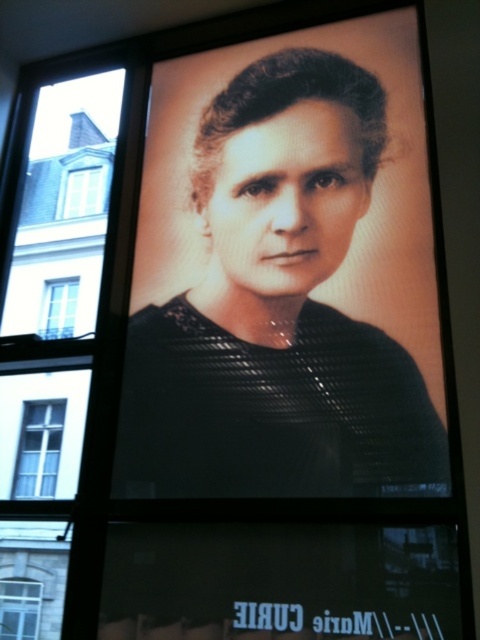
Question: Is white glass window at upper left to the left of clear glass window at upper left from the viewer's perspective?

Choices:
 (A) yes
 (B) no

Answer: (B)

Question: Estimate the real-world distances between objects in this image. Which object is farther from the black textured fabric at center?

Choices:
 (A) white glass window at left
 (B) white glass window at upper left
 (C) clear glass window at upper left

Answer: (B)

Question: Which object is the farthest from the clear glass window at upper left?

Choices:
 (A) white glass window at left
 (B) clear glass window at lower left
 (C) black textured fabric at center
 (D) white glass window at upper left

Answer: (B)

Question: Which point appears farthest from the camera in this image?

Choices:
 (A) (25, 436)
 (B) (70, 294)
 (C) (86, 214)
 (D) (310, 244)

Answer: (C)

Question: Is black textured fabric at center positioned behind clear glass window at upper left?

Choices:
 (A) no
 (B) yes

Answer: (A)

Question: Can you confirm if black textured fabric at center is positioned to the left of white glass window at upper left?

Choices:
 (A) yes
 (B) no

Answer: (B)